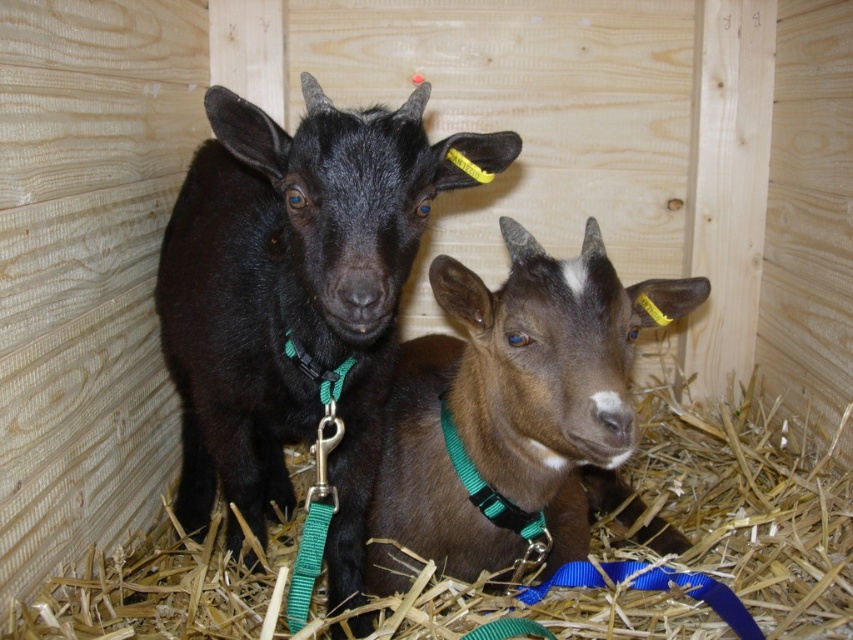
You are standing in front of the enclosure and want to determine which of the two points, point (262, 365) or point (497, 513), is closer to you. Based on the scene description, which point is nearer?

Point (262, 365) is closer to the viewer than point (497, 513).

You are a farmer who needs to clean the enclosure. You have a pitchfork that can reach up to 1.0 meters. Can you reach the brown straw at center with your pitchfork from your current position?

The brown straw at center is 1.02 meters from the camera, so the pitchfork with a maximum reach of 1.0 meters cannot reach it. You need a longer tool.

You are a farmer checking the goats in the enclosure. You notice the brown matte goat at center and the green nylon collar at center. Which one is closer to the entrance of the enclosure?

The brown matte goat at center is in front of the green nylon collar at center, so the brown matte goat at center is closer to the entrance of the enclosure.